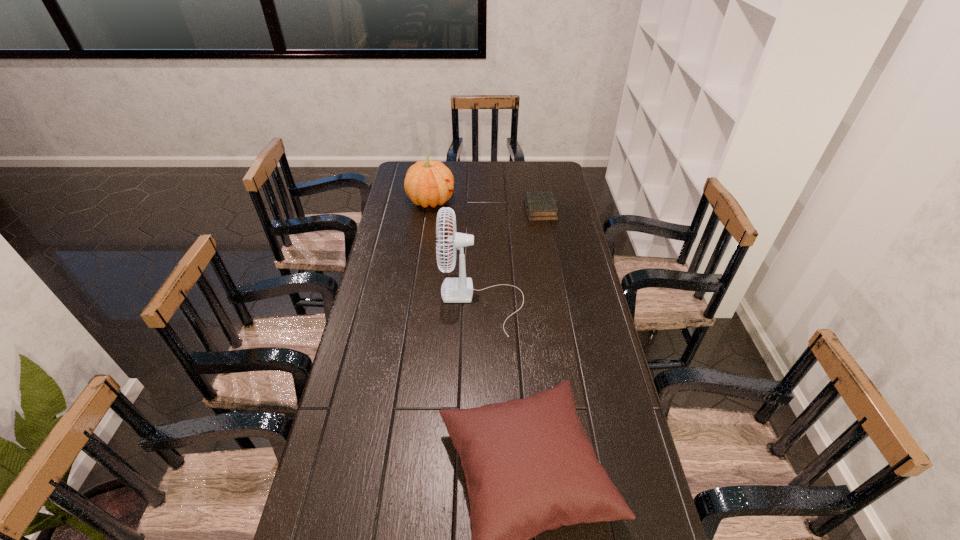
This screenshot has height=540, width=960. Find the location of `object at the right edge`. object at the right edge is located at coordinates click(x=540, y=206).

Find the location of a particular element. vacant space at the far edge of the desktop is located at coordinates (523, 177).

This screenshot has height=540, width=960. I want to click on free space at the left edge of the desktop, so click(375, 292).

Locate an element on the screen. The width and height of the screenshot is (960, 540). vacant region at the right edge is located at coordinates (547, 239).

At what (x,y) coordinates should I click in order to perform the action: click on vacant area between the tallest object and the second tallest object. Please return your answer as a coordinate pair (x, y). This screenshot has height=540, width=960. Looking at the image, I should click on (457, 252).

The image size is (960, 540). Find the location of `unoccupied area between the second nearest object and the second tallest object`. unoccupied area between the second nearest object and the second tallest object is located at coordinates (457, 252).

Identify the location of empty space that is in between the book and the pumpkin. (486, 205).

Point out which object is positioned as the second nearest to the book. Please provide its 2D coordinates. Your answer should be formatted as a tuple, i.e. [(x, y)], where the tuple contains the x and y coordinates of a point satisfying the conditions above.

[(453, 290)]

At what (x,y) coordinates should I click in order to perform the action: click on object that ranks as the third closest to the shortest object. Please return your answer as a coordinate pair (x, y). The image size is (960, 540). Looking at the image, I should click on (529, 466).

This screenshot has height=540, width=960. Find the location of `free space that satisfies the following two spatial constraints: 1. on the back side of the shortest object; 2. on the carved face of the third shortest object`. free space that satisfies the following two spatial constraints: 1. on the back side of the shortest object; 2. on the carved face of the third shortest object is located at coordinates (539, 201).